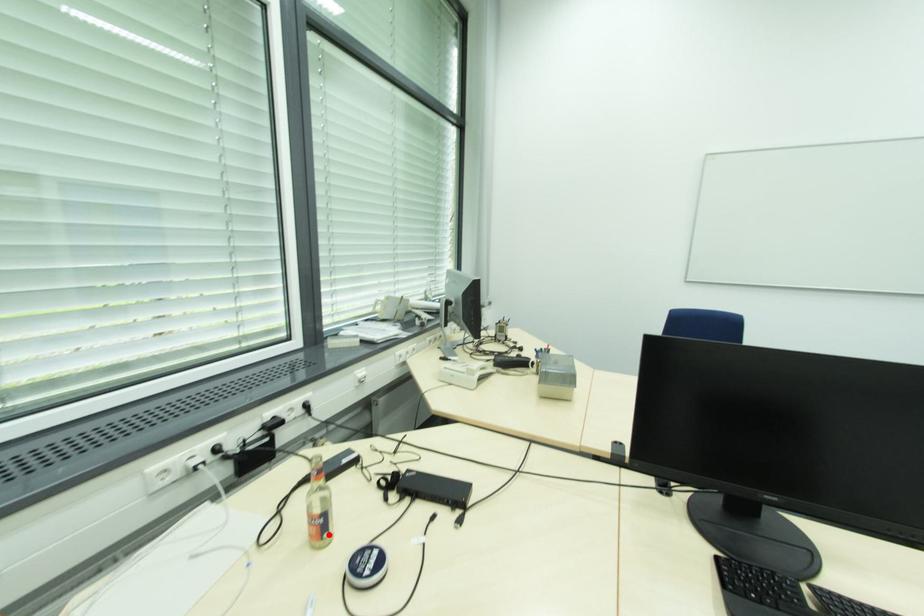
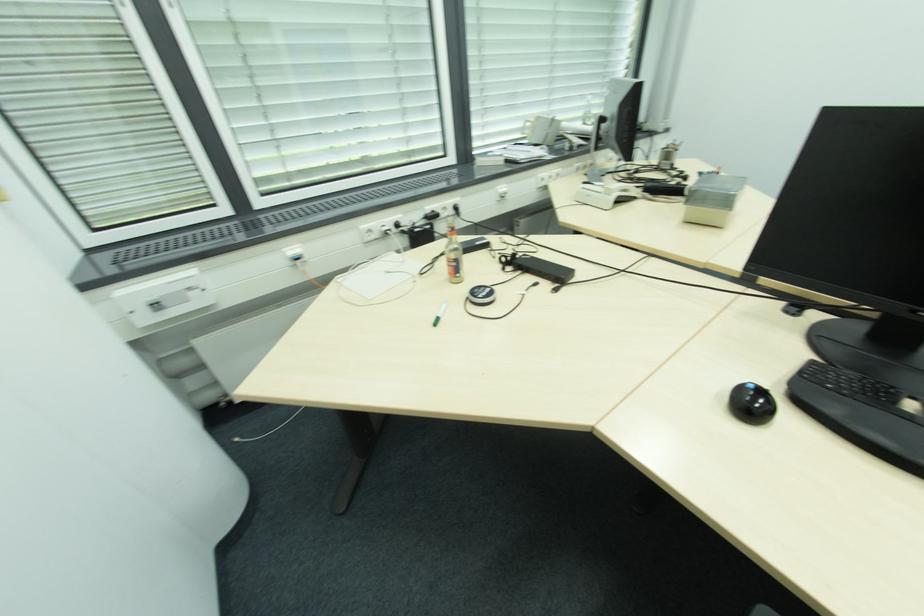
The point at the highlighted location is marked in the first image. Where is the corresponding point in the second image?

(460, 276)